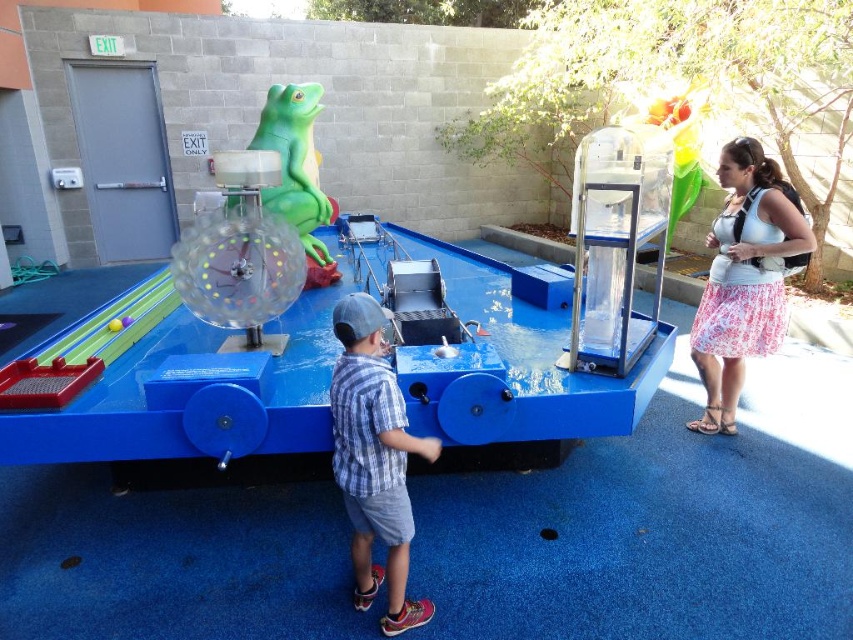
You are standing at the center of the exhibit and notice a point marked at coordinates (746, 276). What object is located at this coordinate?

The point at coordinates (746, 276) corresponds to the floral skirt at right.

You are a museum guide who needs to ensure visitors maintain a minimum distance of 2 meters apart for safety. You see the floral skirt at right and the plaid shirt at center. Can they safely stand at their current positions without violating the distance requirement?

The floral skirt at right and plaid shirt at center are 2.27 meters apart from each other, which exceeds the required 2 meters, so they can safely stand at their current positions without violating the distance requirement.

You are a visitor at the exhibit and want to touch the translucent plastic ball at center and the transparent plastic ball at center. Which one can you reach without moving closer to the exhibit?

The translucent plastic ball at center is closer to the viewer than the transparent plastic ball at center, so you can reach the translucent plastic ball at center without moving closer.